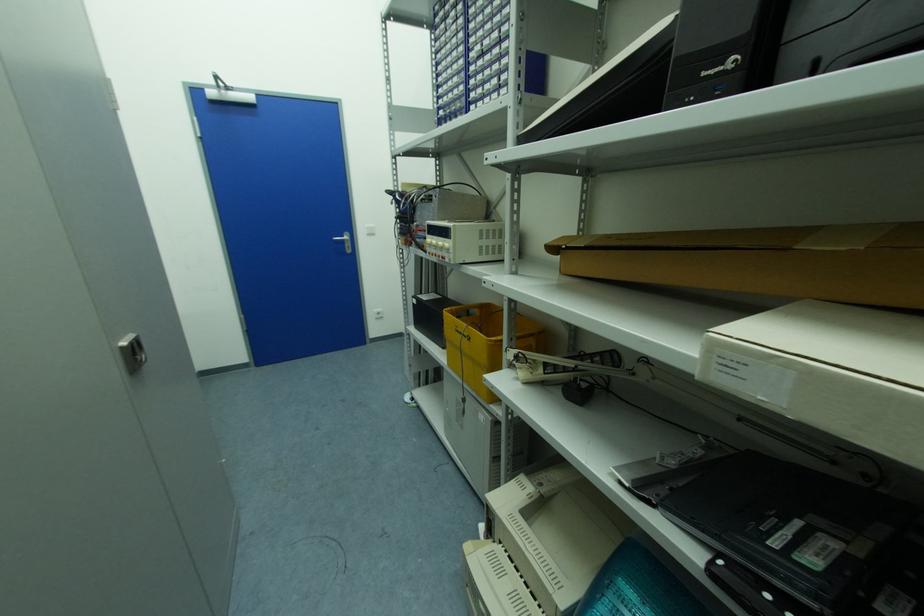
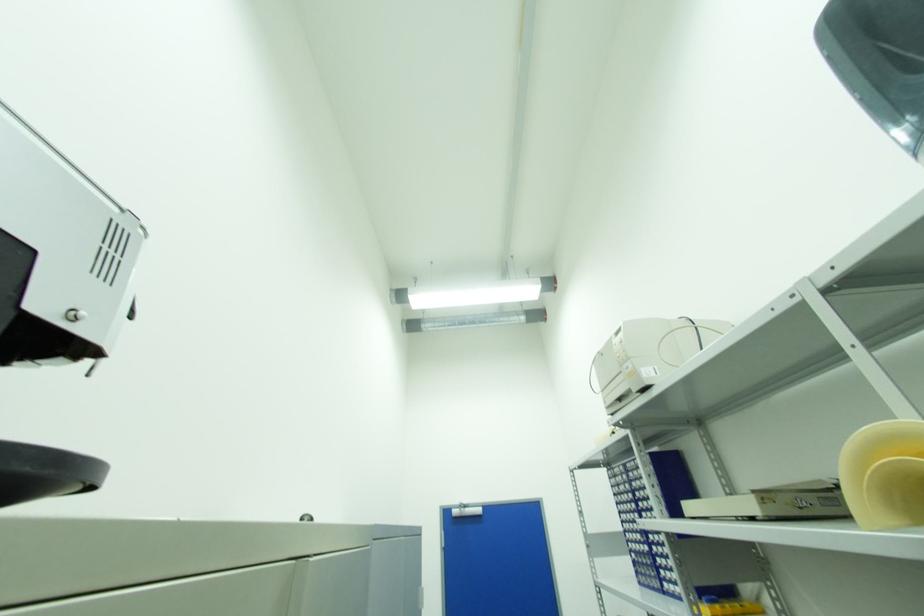
The first image is from the beginning of the video and the second image is from the end. How did the camera likely rotate when shooting the video?

The camera rotated toward left-up.